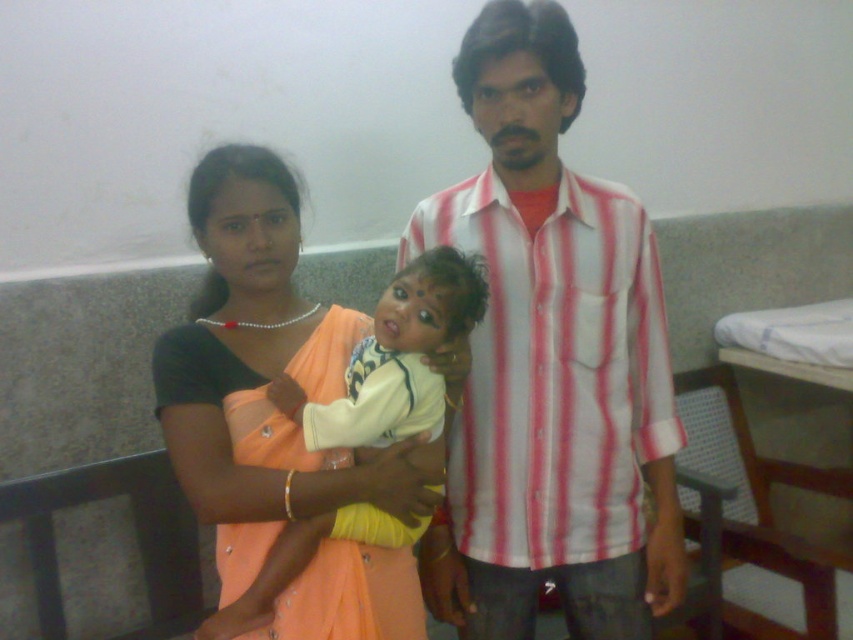
Which is above, striped cotton shirt at center or matte orange sari at center?

striped cotton shirt at center

Who is more forward, (x=572, y=566) or (x=276, y=432)?

Point (x=276, y=432)

This screenshot has height=640, width=853. What do you see at coordinates (550, 364) in the screenshot?
I see `striped cotton shirt at center` at bounding box center [550, 364].

Image resolution: width=853 pixels, height=640 pixels. I want to click on striped cotton shirt at center, so click(x=550, y=364).